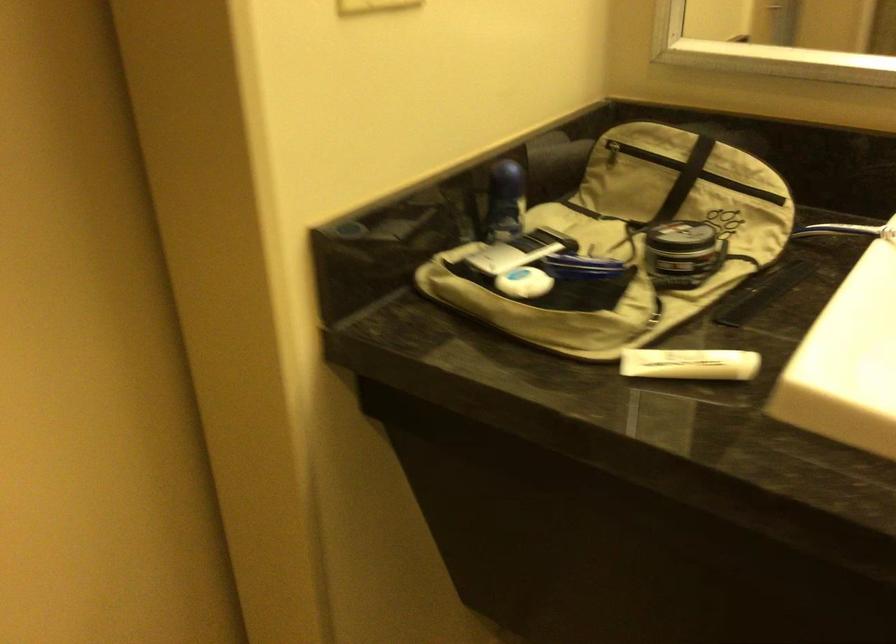
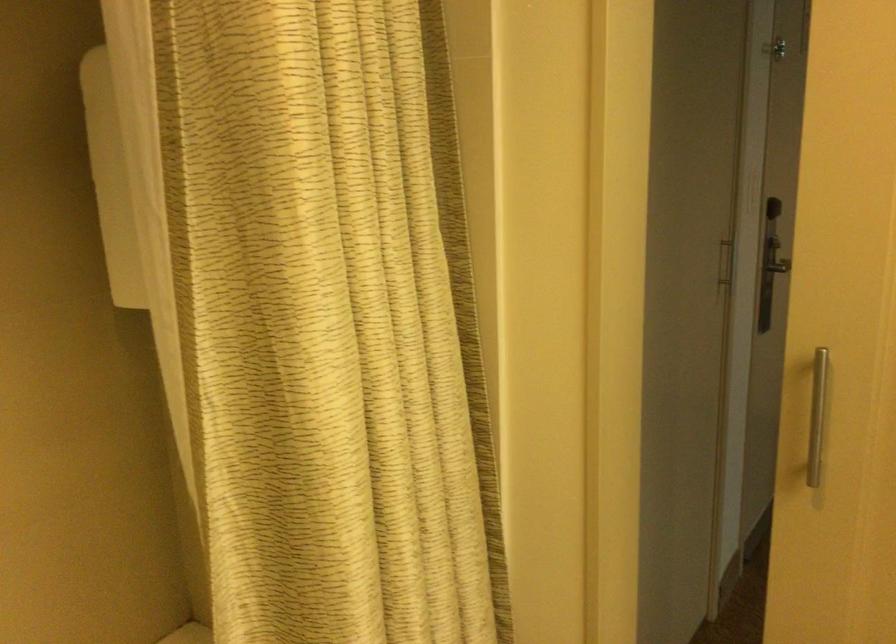
Question: The images are taken continuously from a first-person perspective. In which direction is your viewpoint rotating?

Choices:
 (A) Left
 (B) Right
 (C) Up
 (D) Down

Answer: (A)